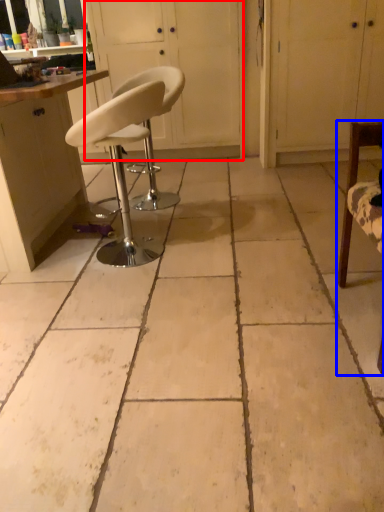
Question: Which object appears closest to the camera in this image, screen door (highlighted by a red box) or chair (highlighted by a blue box)?

Choices:
 (A) screen door
 (B) chair

Answer: (B)